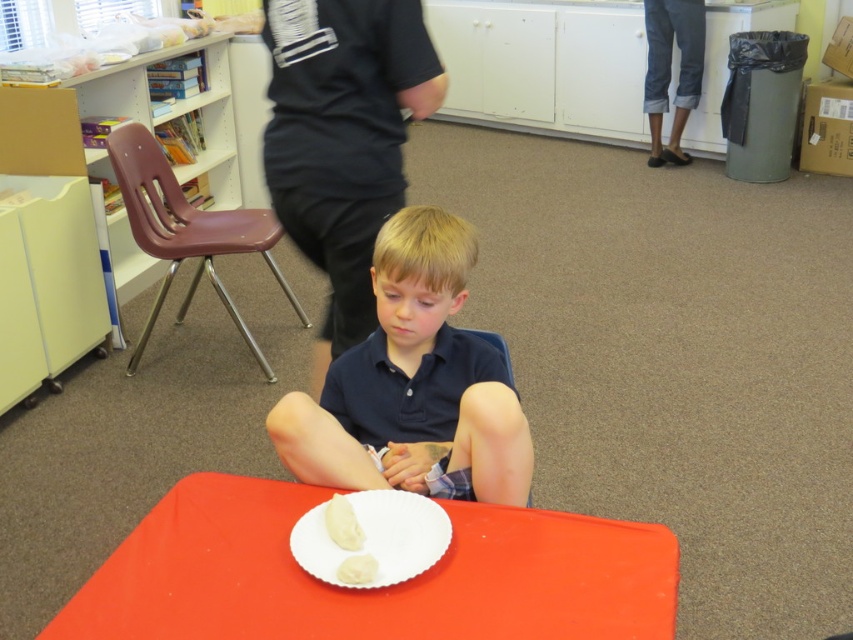
You are a photographer standing in front of the scene. You want to take a picture of both the dark blue shirt at center and the white creamy cake at center. Which object should you position to your left side to include both in the frame?

You should position the white creamy cake at center to your left side because the dark blue shirt at center is to the right of it, so placing the cake on your left will allow both to be captured in the frame.

You are standing in the classroom and want to move from point [473,257] to point [370,580]. Will you be moving towards or away from the camera?

Moving from point [473,257] to point [370,580] means moving away from the camera because point [370,580] is closer to the camera than point [473,257].